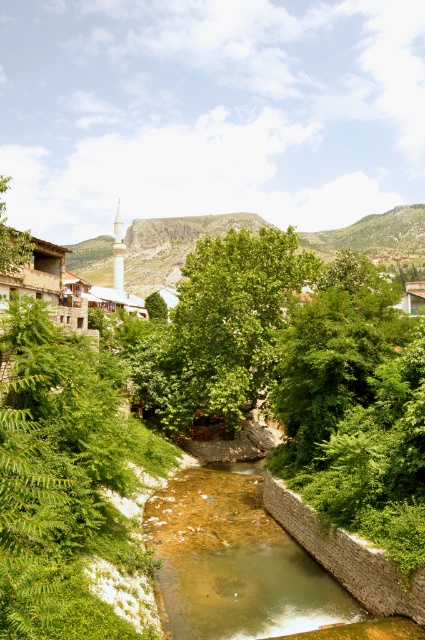
Question: Can you confirm if green leafy tree at center is positioned to the left of green leafy tree at upper left?

Choices:
 (A) no
 (B) yes

Answer: (A)

Question: Does brown/rocky water at center appear on the left side of green leafy tree at upper left?

Choices:
 (A) yes
 (B) no

Answer: (B)

Question: Is green leafy tree at center to the left of green leafy tree at upper left from the viewer's perspective?

Choices:
 (A) yes
 (B) no

Answer: (B)

Question: Estimate the real-world distances between objects in this image. Which object is farther from the green leafy tree at center?

Choices:
 (A) brown/rocky water at center
 (B) green leafy tree at upper left

Answer: (B)

Question: Among these objects, which one is nearest to the camera?

Choices:
 (A) green leafy tree at upper left
 (B) green leafy tree at center
 (C) brown/rocky water at center

Answer: (C)

Question: Considering the real-world distances, which object is closest to the brown/rocky water at center?

Choices:
 (A) green leafy tree at center
 (B) green leafy tree at upper left

Answer: (A)